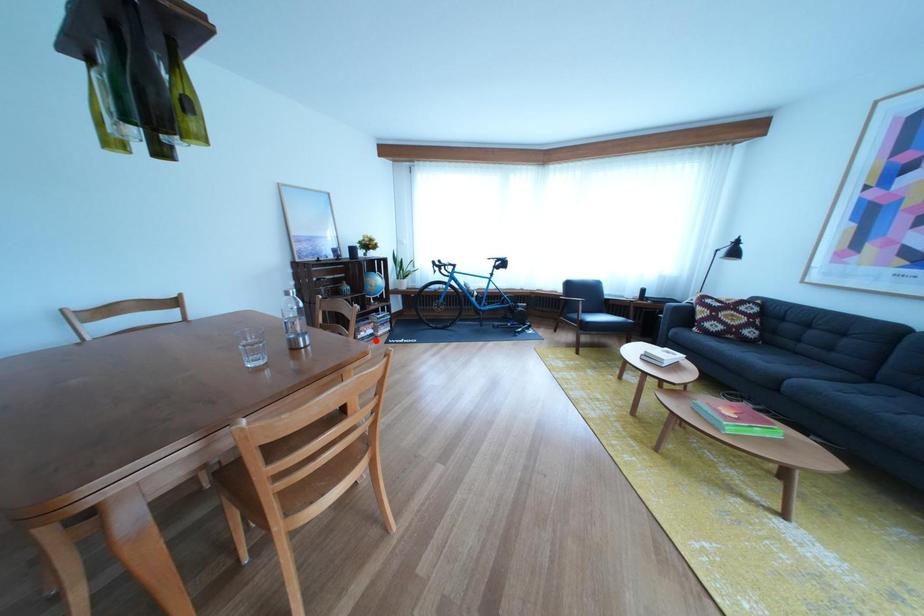
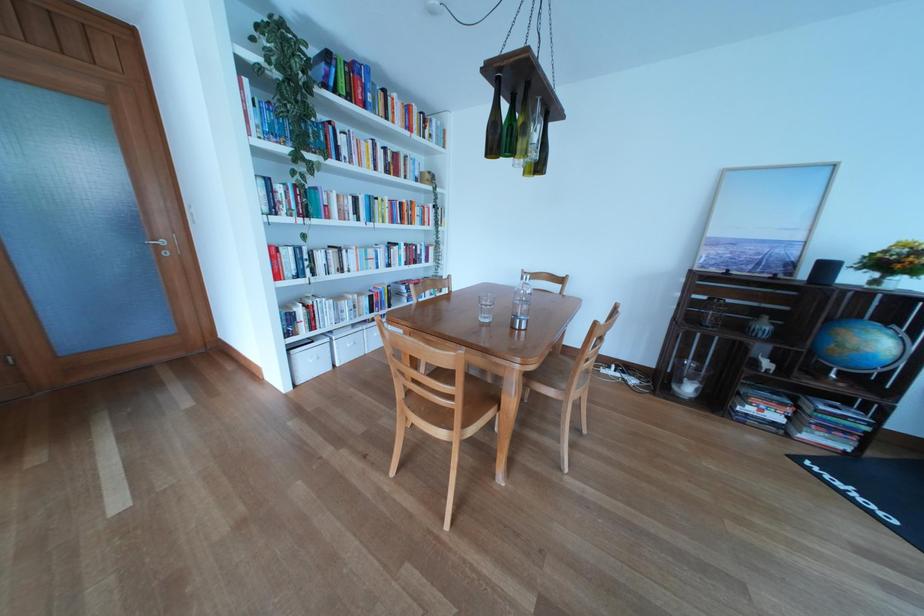
Locate, in the second image, the point that corresponds to the highlighted location in the first image.

(762, 416)